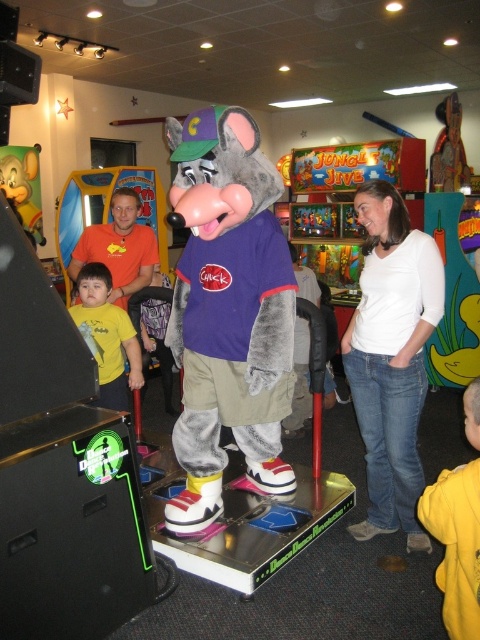
You are standing in the arcade and see the point marked at coordinates (x=228, y=312). Which object is this point located on?

The point at coordinates (x=228, y=312) is located on the plush gray mouse at center.

You are a photographer trying to capture a clear photo of the white cotton shirt at center and the yellow fleece jacket at lower right. Which one will appear larger in the photo?

The white cotton shirt at center appears larger in the photo because it is positioned over the yellow fleece jacket at lower right, making it closer to the camera.

You are a visitor at the arcade and want to take a photo of the plush gray mouse at center and the yellow matte shirt at left. Which object is located higher in the image?

The plush gray mouse at center is positioned over the yellow matte shirt at left, so it is higher in the image.